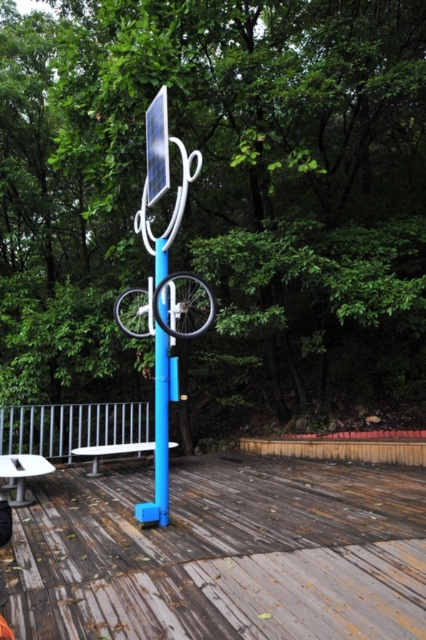
Is silver metallic rail at lower left wider than blue plastic pole at center?

Indeed, silver metallic rail at lower left has a greater width compared to blue plastic pole at center.

Between silver metallic rail at lower left and blue plastic pole at center, which one is positioned lower?

silver metallic rail at lower left is below.

Does point (32, 449) come closer to viewer compared to point (164, 275)?

No, (32, 449) is behind (164, 275).

You are a GUI agent. You are given a task and a screenshot of the screen. Output one action in this format:
    pyautogui.click(x=<x>, y=<y>)
    Task: Click on the silver metallic rail at lower left
    
    Given the screenshot: What is the action you would take?
    pyautogui.click(x=71, y=426)

Is black matte bicycle at center thinner than white plastic bench at lower center?

Yes.

Who is shorter, black matte bicycle at center or white plastic bench at lower center?

white plastic bench at lower center

The height and width of the screenshot is (640, 426). What do you see at coordinates (166, 307) in the screenshot? I see `black matte bicycle at center` at bounding box center [166, 307].

Find the location of a particular element. Image resolution: width=426 pixels, height=640 pixels. black matte bicycle at center is located at coordinates (166, 307).

Can you confirm if wooden deck at center is positioned above white plastic picnic table at lower left?

Actually, wooden deck at center is below white plastic picnic table at lower left.

Can you confirm if wooden deck at center is positioned below white plastic picnic table at lower left?

Correct, wooden deck at center is located below white plastic picnic table at lower left.

Where is `wooden deck at center`? Image resolution: width=426 pixels, height=640 pixels. wooden deck at center is located at coordinates (221, 554).